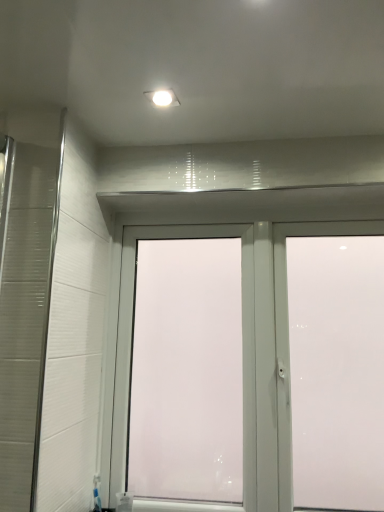
What do you see at coordinates (205, 236) in the screenshot? This screenshot has width=384, height=512. I see `white plastic door at center` at bounding box center [205, 236].

Measure the distance between point (381, 192) and camera.

Point (381, 192) and camera are 4.72 feet apart.

The height and width of the screenshot is (512, 384). I want to click on white plastic door at center, so click(205, 236).

The image size is (384, 512). Find the location of `white plastic door at center`. white plastic door at center is located at coordinates (205, 236).